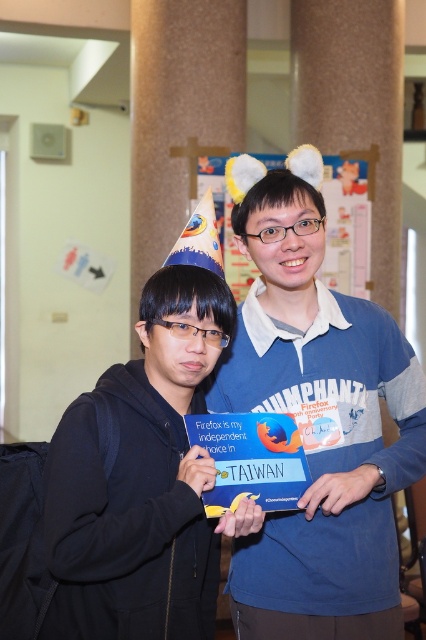
Question: Where is blue fabric shirt at center located in relation to black matte jacket at center in the image?

Choices:
 (A) right
 (B) left

Answer: (A)

Question: Is blue fabric shirt at center closer to camera compared to black matte jacket at center?

Choices:
 (A) no
 (B) yes

Answer: (A)

Question: Which point appears farthest from the camera in this image?

Choices:
 (A) (294, 316)
 (B) (66, 566)

Answer: (A)

Question: Which point is farther from the camera taking this photo?

Choices:
 (A) (129, 604)
 (B) (379, 554)

Answer: (B)

Question: Which point is farther to the camera?

Choices:
 (A) (149, 387)
 (B) (342, 492)

Answer: (A)

Question: Is blue fabric shirt at center positioned in front of black matte jacket at center?

Choices:
 (A) no
 (B) yes

Answer: (A)